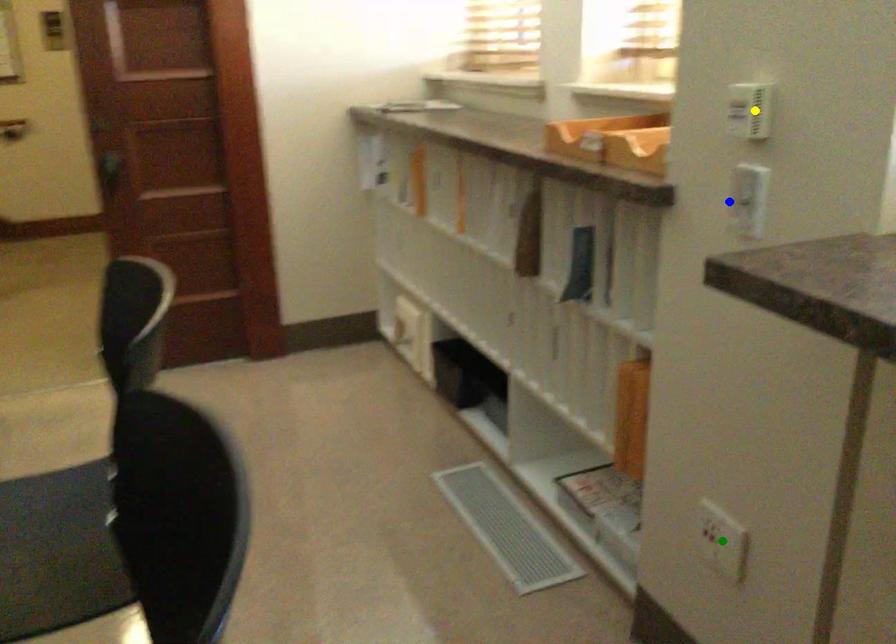
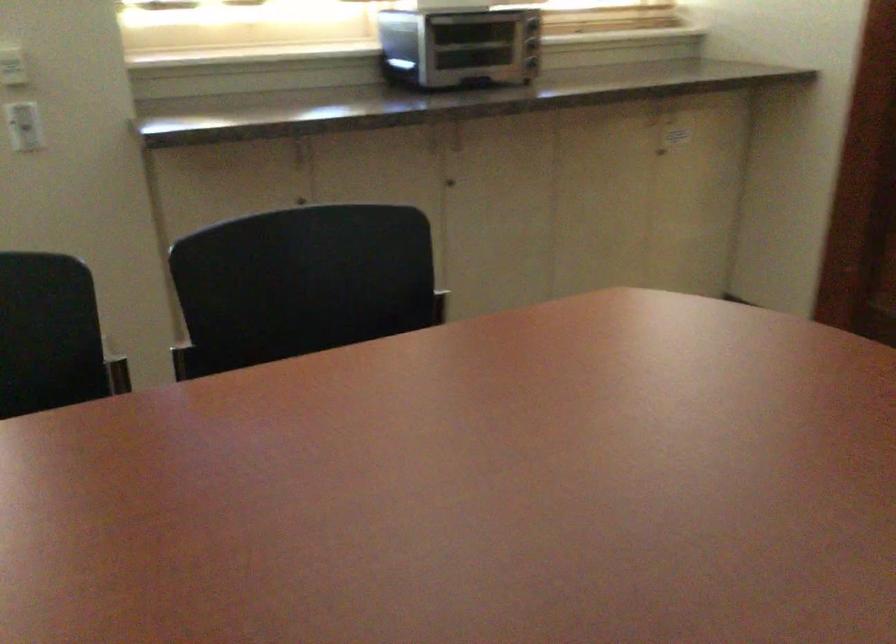
I am providing you with two images of the same scene from different viewpoints. Three points are marked in image1. Which point corresponds to a part or object that is occluded in image2?In image1, three points are marked. Which of them correspond to a part or object that is occluded in image2?Among the three points shown in image1, which one corresponds to a part or object that is no longer visible due to occlusion in image2?

green point cannot be seen in image2.